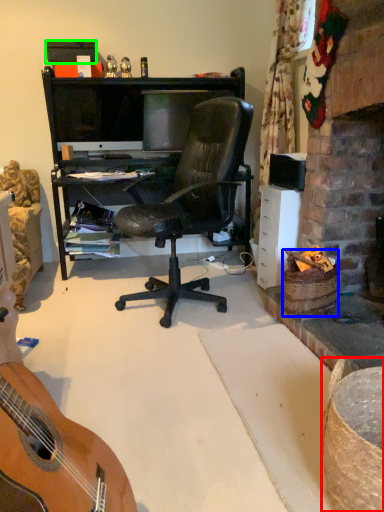
Question: Estimate the real-world distances between objects in this image. Which object is closer to picnic basket (highlighted by a red box), picnic basket (highlighted by a blue box) or box (highlighted by a green box)?

Choices:
 (A) picnic basket
 (B) box

Answer: (A)